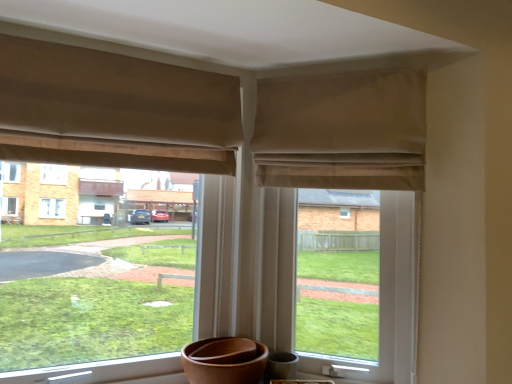
At what (x,y) coordinates should I click in order to perform the action: click on free point above beige fabric curtain at upper left, the second curtain in the right-to-left sequence (from a real-world perspective). Please return your answer as a coordinate pair (x, y). This screenshot has height=384, width=512. Looking at the image, I should click on (108, 43).